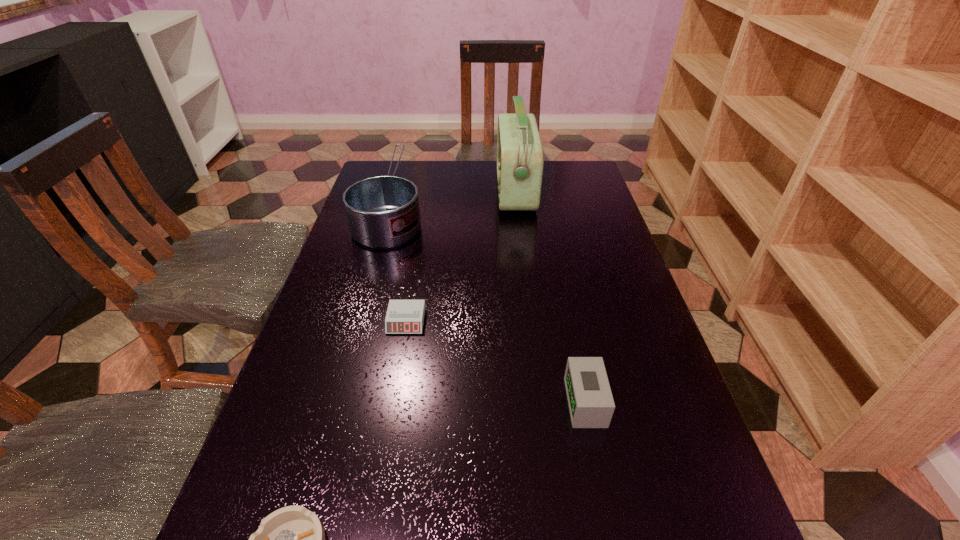
Identify the location of radio receiver. [520, 157].

You are a GUI agent. You are given a task and a screenshot of the screen. Output one action in this format:
    pyautogui.click(x=<x>, y=<y>)
    Task: Click on the fourth shortest object
    The height and width of the screenshot is (540, 960).
    Given the screenshot: What is the action you would take?
    pyautogui.click(x=383, y=211)

Find the location of a particular element. the second nearest object is located at coordinates (591, 405).

Where is `the taller alarm clock`? This screenshot has height=540, width=960. the taller alarm clock is located at coordinates (591, 405).

Image resolution: width=960 pixels, height=540 pixels. In order to click on the farther alarm clock in this screenshot , I will do `click(403, 316)`.

You are a GUI agent. You are given a task and a screenshot of the screen. Output one action in this format:
    pyautogui.click(x=<x>, y=<y>)
    Task: Click on the shorter alarm clock
    Image resolution: width=960 pixels, height=540 pixels.
    Given the screenshot: What is the action you would take?
    pyautogui.click(x=403, y=316)

The width and height of the screenshot is (960, 540). Identify the location of vacant space located on the front panel of the tallest object. (444, 191).

Find the location of a particular element. This screenshot has width=960, height=540. free space located 0.190m on the front panel of the tallest object is located at coordinates (438, 191).

You are a GUI agent. You are given a task and a screenshot of the screen. Output one action in this format:
    pyautogui.click(x=<x>, y=<y>)
    Task: Click on the free space located on the front panel of the tallest object
    
    Given the screenshot: What is the action you would take?
    pyautogui.click(x=450, y=191)

Find the location of `vacant space situated 0.050m with the handle extending from one side of the saucepan`. vacant space situated 0.050m with the handle extending from one side of the saucepan is located at coordinates (405, 162).